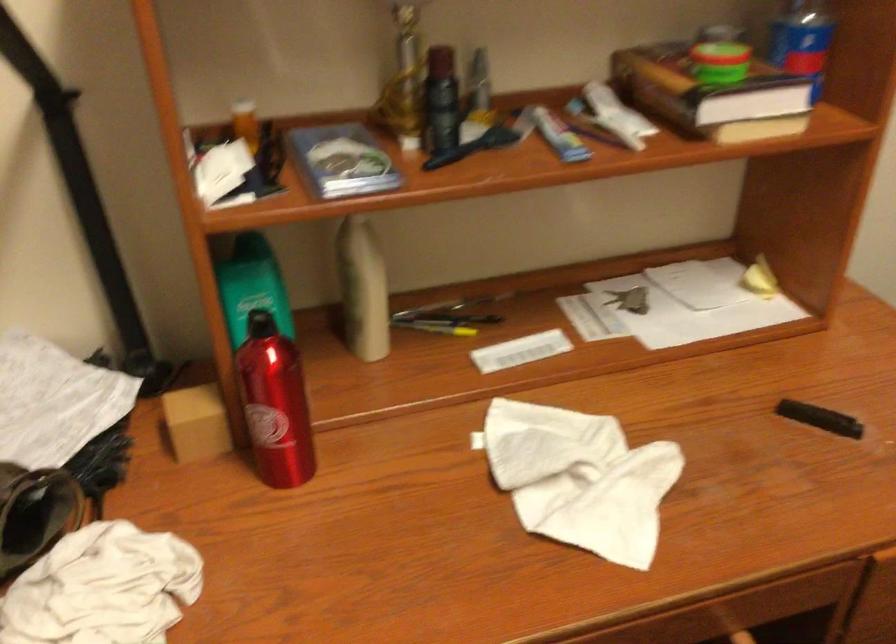
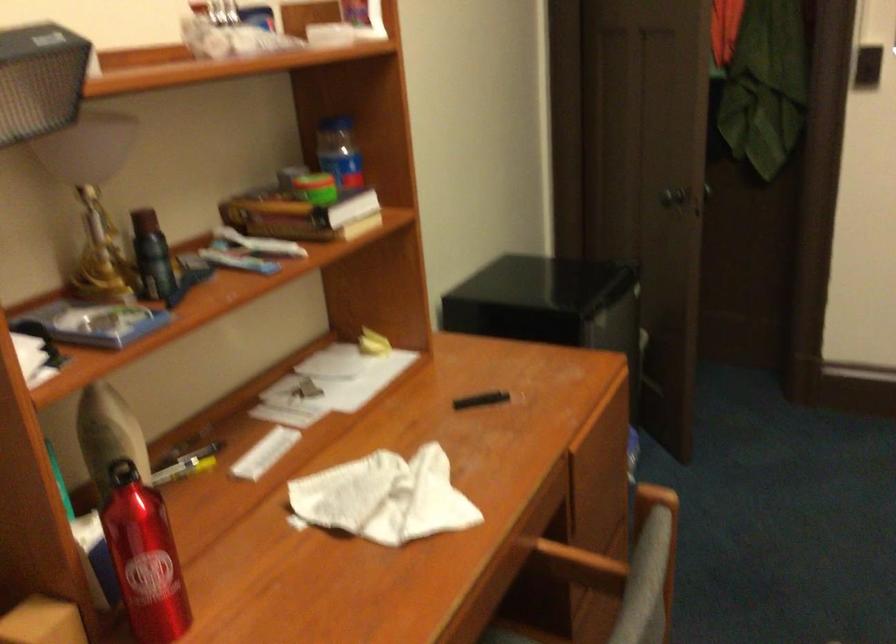
Find the pixel in the second image that matches the point at 817,418 in the first image.

(480, 400)